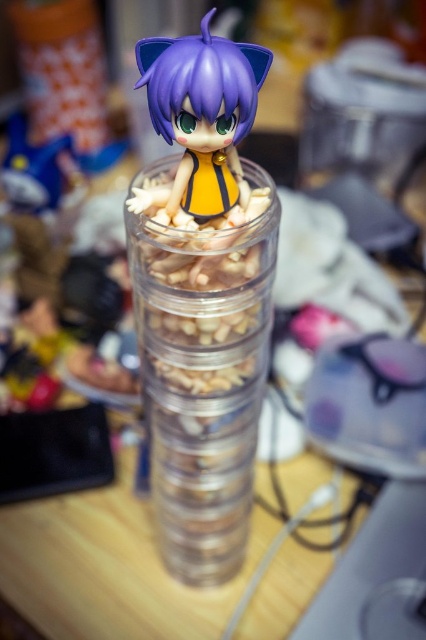
Which is in front, point (271, 259) or point (166, 44)?

Point (166, 44)

Does transparent plastic container at center have a larger size compared to matte purple figurine at center?

Yes, transparent plastic container at center is bigger than matte purple figurine at center.

Is point (146, 253) farther from viewer compared to point (178, 76)?

Yes.

You are a GUI agent. You are given a task and a screenshot of the screen. Output one action in this format:
    pyautogui.click(x=<x>, y=<y>)
    Task: Click on the transparent plastic container at center
    
    Given the screenshot: What is the action you would take?
    pyautogui.click(x=204, y=378)